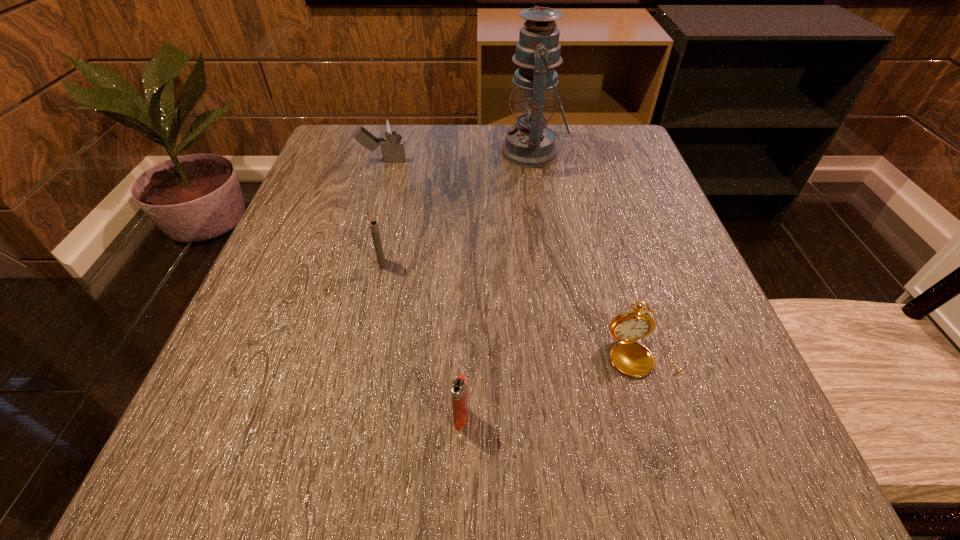
The image size is (960, 540). I want to click on free area in between the fourth farthest object and the third nearest object, so click(x=513, y=309).

The width and height of the screenshot is (960, 540). Identify the location of vacant area between the nearest object and the second nearest object. (552, 386).

At what (x,y) coordinates should I click in order to perform the action: click on free space between the second farthest igniter and the rightmost igniter. Please return your answer as a coordinate pair (x, y). The height and width of the screenshot is (540, 960). Looking at the image, I should click on (421, 341).

Where is `free space between the second nearest object and the farthest igniter`? free space between the second nearest object and the farthest igniter is located at coordinates (514, 258).

Locate an element on the screen. free spot between the farthest igniter and the second nearest object is located at coordinates (514, 258).

At what (x,y) coordinates should I click in order to perform the action: click on object that is the third closest to the lantern. Please return your answer as a coordinate pair (x, y). The width and height of the screenshot is (960, 540). Looking at the image, I should click on (631, 358).

Where is `object identified as the third closest to the third object from left to right`? The height and width of the screenshot is (540, 960). object identified as the third closest to the third object from left to right is located at coordinates (530, 143).

Locate which igniter is the closest to the second nearest object. Please provide its 2D coordinates. Your answer should be formatted as a tuple, i.e. [(x, y)], where the tuple contains the x and y coordinates of a point satisfying the conditions above.

[(458, 387)]

The image size is (960, 540). I want to click on igniter identified as the closest to the farthest igniter, so click(372, 221).